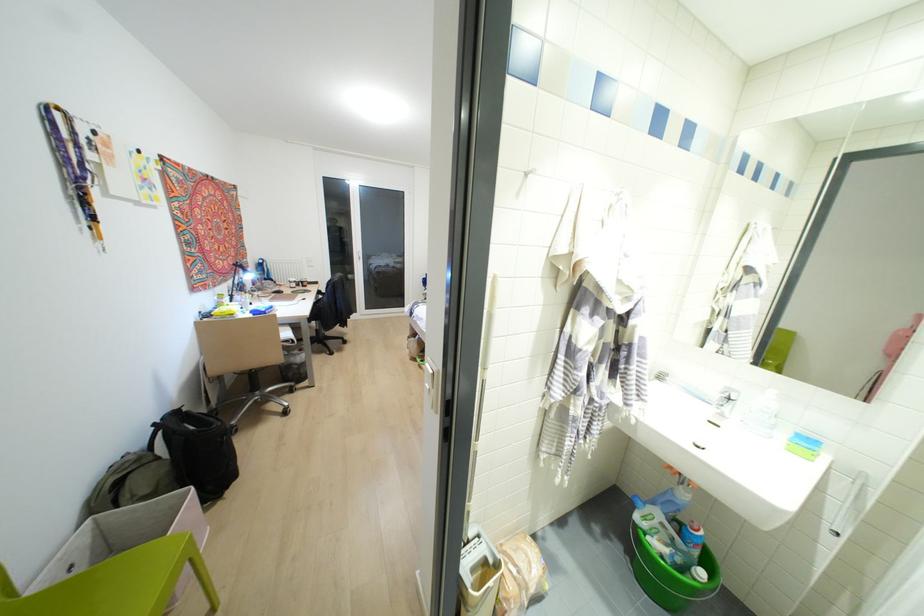
Find the location of `green bucket`. green bucket is located at coordinates (671, 576).